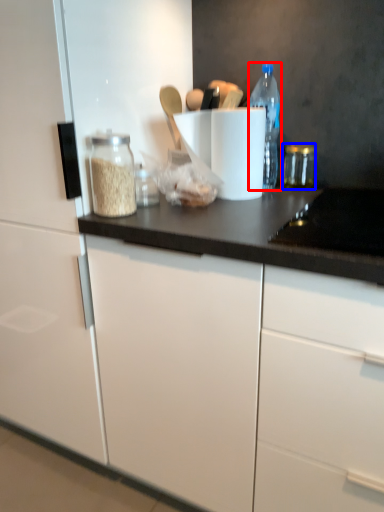
Question: Which point is closer to the camera, bottle (highlighted by a red box) or glass jar (highlighted by a blue box)?

Choices:
 (A) bottle
 (B) glass jar

Answer: (A)